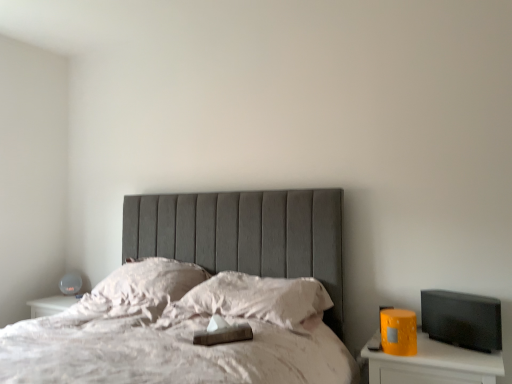
Question: Should I look upward or downward to see white soft pillow at center, the 2th pillow when ordered from left to right?

Choices:
 (A) down
 (B) up

Answer: (A)

Question: From a real-world perspective, is white soft pillow at center, marked as the first pillow in a left-to-right arrangement, physically above white soft pillow at center, the 2th pillow when ordered from left to right?

Choices:
 (A) no
 (B) yes

Answer: (B)

Question: From a real-world perspective, is white soft pillow at center, marked as the first pillow in a left-to-right arrangement, beneath white soft pillow at center, the 2th pillow when ordered from left to right?

Choices:
 (A) no
 (B) yes

Answer: (A)

Question: Is white soft pillow at center, marked as the first pillow in a left-to-right arrangement, positioned behind white soft pillow at center, the 2th pillow when ordered from left to right?

Choices:
 (A) yes
 (B) no

Answer: (A)

Question: Does white soft pillow at center, arranged as the 2th pillow when viewed from the right, come in front of white soft pillow at center, the 2th pillow when ordered from left to right?

Choices:
 (A) yes
 (B) no

Answer: (B)

Question: From the image's perspective, is white soft pillow at center, arranged as the 2th pillow when viewed from the right, located above white soft pillow at center, the 2th pillow when ordered from left to right?

Choices:
 (A) yes
 (B) no

Answer: (A)

Question: Is white soft pillow at center, arranged as the 2th pillow when viewed from the right, not within white soft pillow at center, the 2th pillow when ordered from left to right?

Choices:
 (A) no
 (B) yes

Answer: (B)

Question: Can we say white soft pillow at center, the 2th pillow when ordered from left to right, lies outside matte yellow nightstand at right?

Choices:
 (A) no
 (B) yes

Answer: (B)

Question: Is the position of white soft pillow at center, which ranks as the first pillow in right-to-left order, less distant than that of matte yellow nightstand at right?

Choices:
 (A) no
 (B) yes

Answer: (A)

Question: Does white soft pillow at center, the 2th pillow when ordered from left to right, have a greater width compared to matte yellow nightstand at right?

Choices:
 (A) yes
 (B) no

Answer: (A)

Question: Does white soft pillow at center, which ranks as the first pillow in right-to-left order, have a lesser width compared to matte yellow nightstand at right?

Choices:
 (A) yes
 (B) no

Answer: (B)

Question: Considering the relative sizes of white soft pillow at center, the 2th pillow when ordered from left to right, and matte yellow nightstand at right in the image provided, is white soft pillow at center, the 2th pillow when ordered from left to right, taller than matte yellow nightstand at right?

Choices:
 (A) no
 (B) yes

Answer: (A)

Question: Is white soft pillow at center, the 2th pillow when ordered from left to right, smaller than matte yellow nightstand at right?

Choices:
 (A) no
 (B) yes

Answer: (B)

Question: Considering the relative positions of matte white table lamp at left and white soft pillow at center, which ranks as the first pillow in right-to-left order, in the image provided, is matte white table lamp at left to the right of white soft pillow at center, which ranks as the first pillow in right-to-left order, from the viewer's perspective?

Choices:
 (A) no
 (B) yes

Answer: (A)